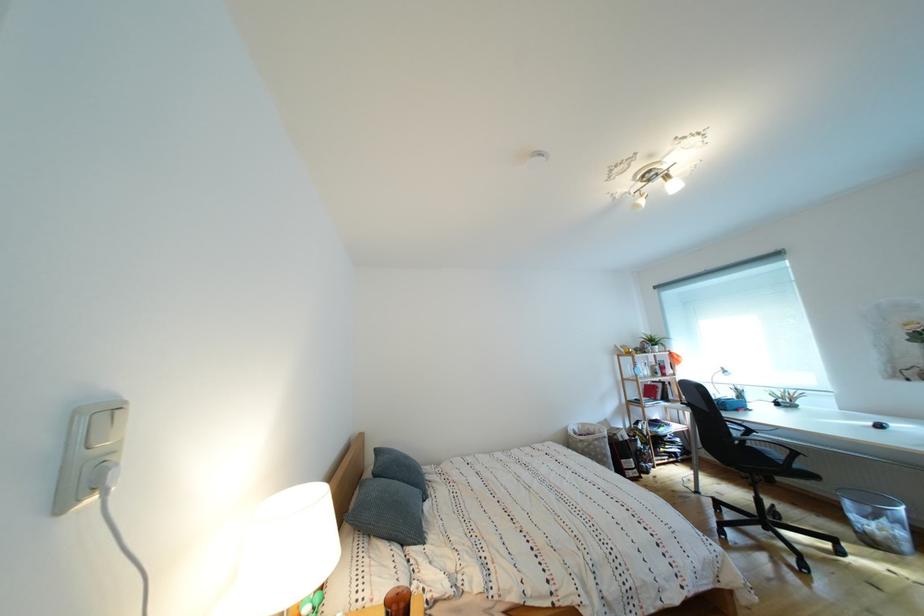
Locate an element on the screen. This screenshot has height=616, width=924. black computer mouse is located at coordinates (880, 424).